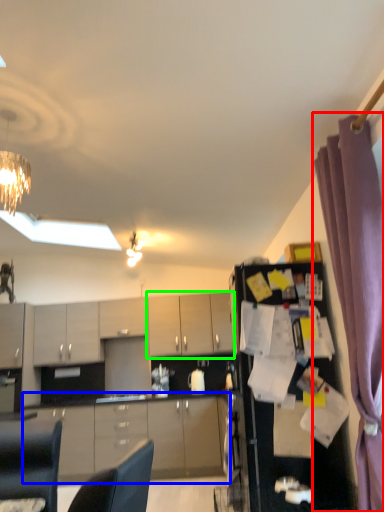
Question: Based on their relative distances, which object is nearer to curtain (highlighted by a red box)? Choose from cabinetry (highlighted by a blue box) and cabinetry (highlighted by a green box).

Choices:
 (A) cabinetry
 (B) cabinetry

Answer: (A)